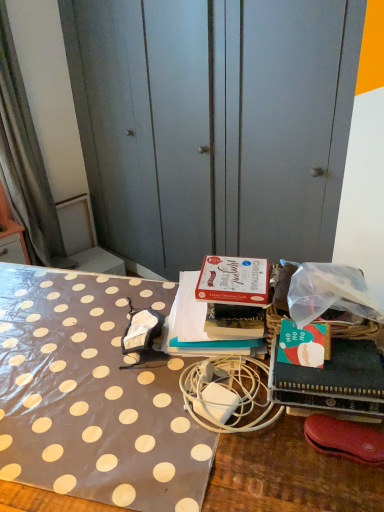
The image size is (384, 512). In order to click on empty space that is in between matte cardboard box at center, the 1th book in the back-to-front sequence, and white matte charger at center in this screenshot , I will do `click(163, 380)`.